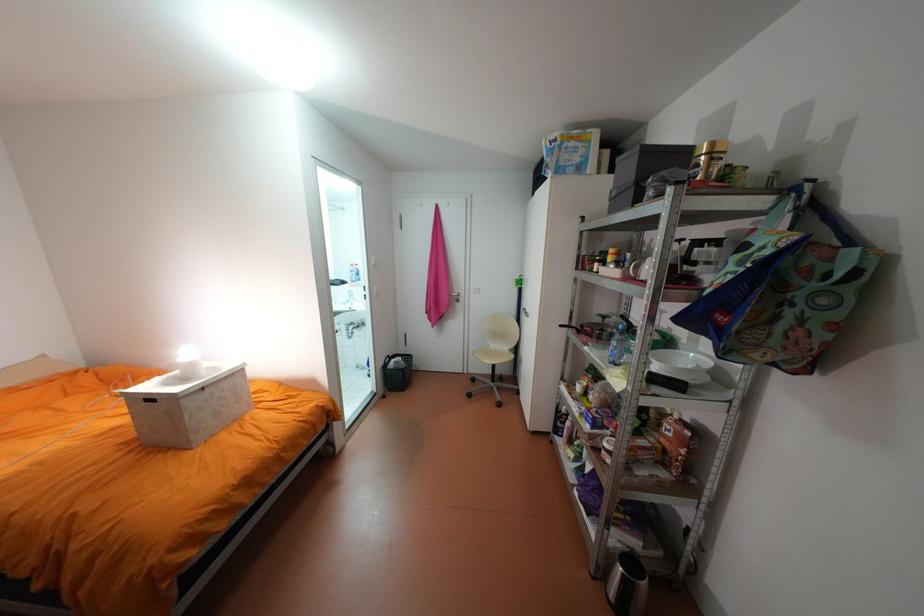
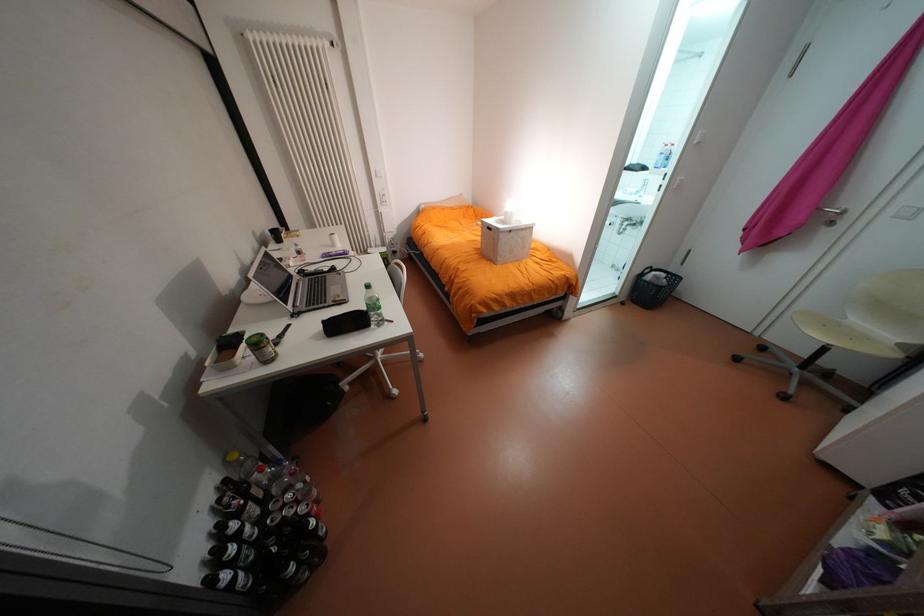
In the second image, find the point that corresponds to [359,326] in the first image.

(636, 223)